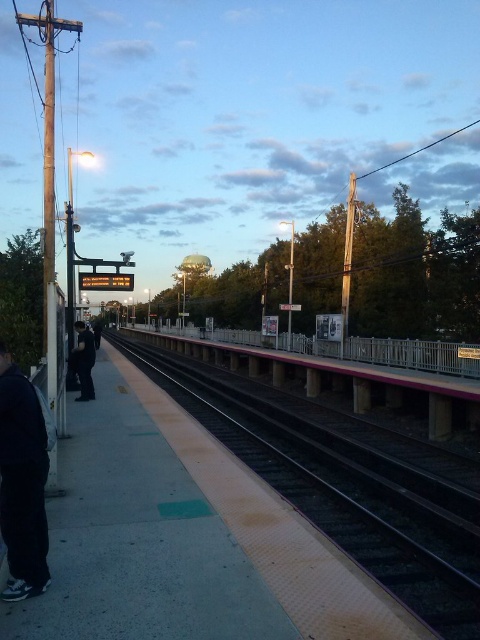
Question: Is smooth concrete track at center positioned at the back of dark blue jeans at left?

Choices:
 (A) no
 (B) yes

Answer: (A)

Question: Is black matte pants at lower left bigger than dark blue jeans at left?

Choices:
 (A) yes
 (B) no

Answer: (B)

Question: Which object is farther from the camera taking this photo?

Choices:
 (A) smooth concrete track at center
 (B) dark blue jeans at left
 (C) black matte pants at lower left

Answer: (B)

Question: Which point is closer to the camera taking this photo?

Choices:
 (A) (86, 349)
 (B) (420, 541)
 (C) (1, 440)

Answer: (C)

Question: Does smooth concrete track at center lie behind black matte pants at lower left?

Choices:
 (A) yes
 (B) no

Answer: (A)

Question: Among these points, which one is nearest to the camera?

Choices:
 (A) (349, 454)
 (B) (9, 388)

Answer: (B)